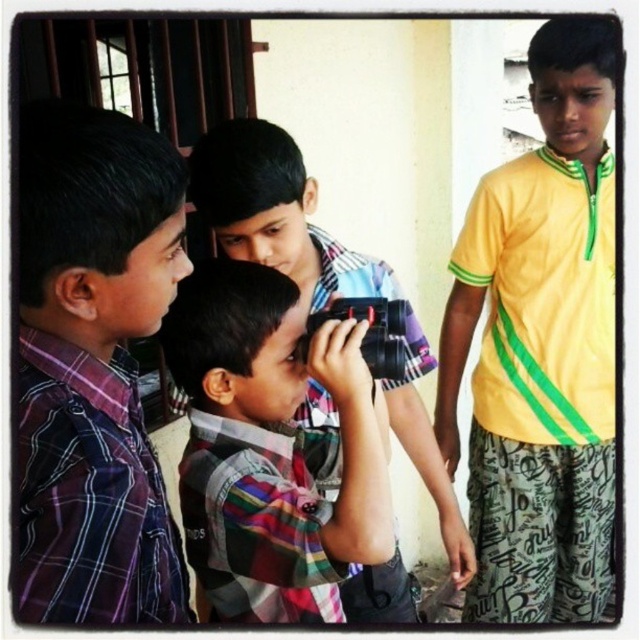
You are a photographer trying to capture both the yellow smooth shirt at right and the purple plaid shirt at left in a single frame. Based on their positions, which one is closer to the camera?

The yellow smooth shirt at right is closer to the camera because the purple plaid shirt at left is positioned behind it.